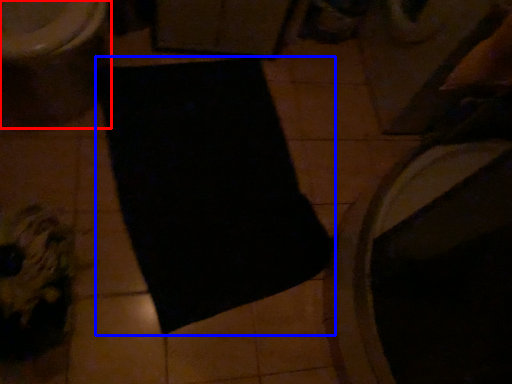
Question: Which of the following is the closest to the observer, toilet (highlighted by a red box) or yoga mat (highlighted by a blue box)?

Choices:
 (A) toilet
 (B) yoga mat

Answer: (A)